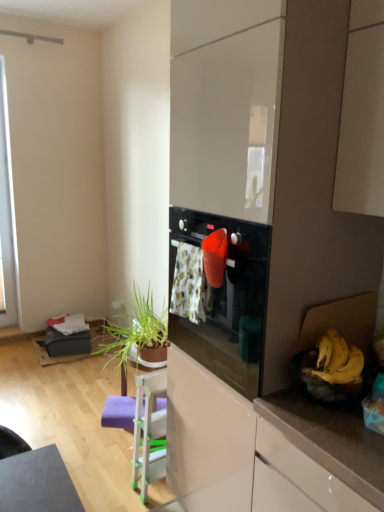
Question: From a real-world perspective, does yellow matte bananas at right stand above green leafy plant at lower left?

Choices:
 (A) yes
 (B) no

Answer: (A)

Question: Is yellow matte bananas at right directly adjacent to green leafy plant at lower left?

Choices:
 (A) yes
 (B) no

Answer: (B)

Question: Does yellow matte bananas at right have a smaller size compared to green leafy plant at lower left?

Choices:
 (A) yes
 (B) no

Answer: (A)

Question: Is yellow matte bananas at right aimed at green leafy plant at lower left?

Choices:
 (A) no
 (B) yes

Answer: (A)

Question: Considering the relative sizes of yellow matte bananas at right and green leafy plant at lower left in the image provided, is yellow matte bananas at right taller than green leafy plant at lower left?

Choices:
 (A) no
 (B) yes

Answer: (A)

Question: From a real-world perspective, is yellow matte bananas at right above or below green leafy plant at lower left?

Choices:
 (A) below
 (B) above

Answer: (B)

Question: Does point (329, 340) appear closer or farther from the camera than point (144, 308)?

Choices:
 (A) farther
 (B) closer

Answer: (B)

Question: Considering the relative positions of yellow matte bananas at right and green leafy plant at lower left in the image provided, is yellow matte bananas at right to the left or to the right of green leafy plant at lower left?

Choices:
 (A) left
 (B) right

Answer: (B)

Question: Considering the positions of yellow matte bananas at right and green leafy plant at lower left in the image, is yellow matte bananas at right bigger or smaller than green leafy plant at lower left?

Choices:
 (A) big
 (B) small

Answer: (B)

Question: In terms of width, does green leafy plant at lower left look wider or thinner when compared to yellow matte bananas at right?

Choices:
 (A) wide
 (B) thin

Answer: (A)

Question: Considering their positions, is green leafy plant at lower left located in front of or behind yellow matte bananas at right?

Choices:
 (A) behind
 (B) front

Answer: (A)

Question: Would you say green leafy plant at lower left is to the left or to the right of yellow matte bananas at right in the picture?

Choices:
 (A) left
 (B) right

Answer: (A)

Question: Do you think green leafy plant at lower left is within yellow matte bananas at right, or outside of it?

Choices:
 (A) inside
 (B) outside

Answer: (B)

Question: Considering the positions of point (180, 250) and point (142, 379), is point (180, 250) closer or farther from the camera than point (142, 379)?

Choices:
 (A) closer
 (B) farther

Answer: (A)

Question: From the image's perspective, is floral fabric laundry at center above or below white plastic chair at lower center?

Choices:
 (A) above
 (B) below

Answer: (A)